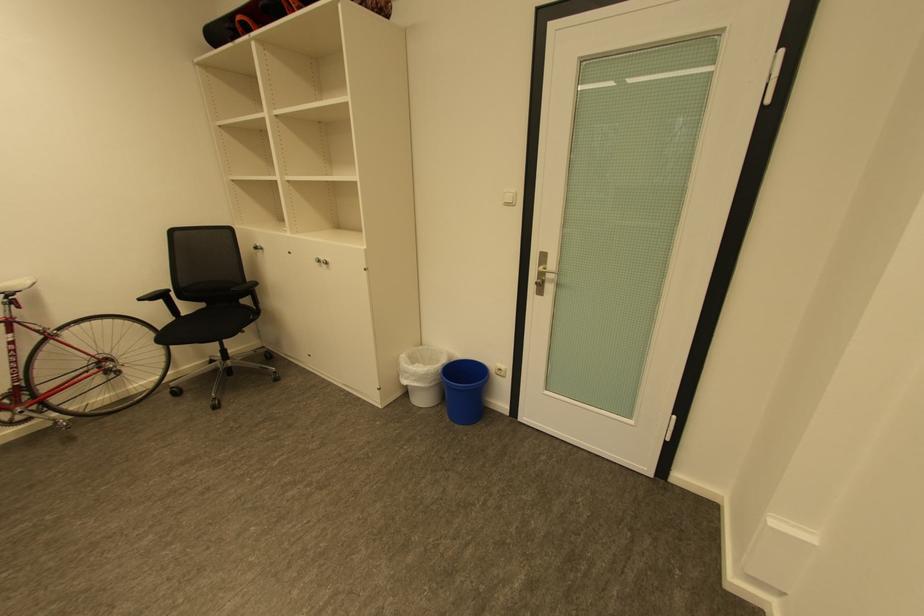
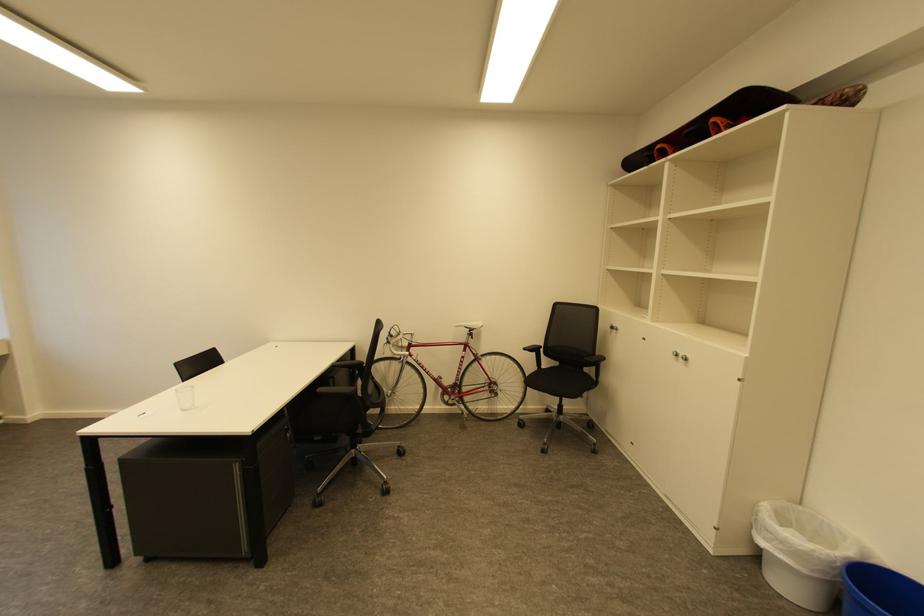
In the second image, find the point that corresponds to (x=325, y=262) in the first image.

(684, 355)